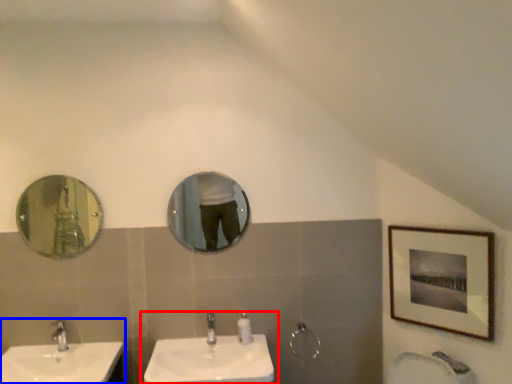
Question: Which of the following is the closest to the observer, sink (highlighted by a red box) or sink (highlighted by a blue box)?

Choices:
 (A) sink
 (B) sink

Answer: (B)